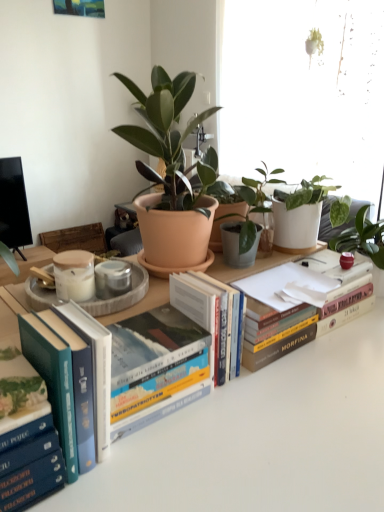
Locate an element on the screen. This screenshot has height=512, width=384. free space above hardcover book at center, positioned as the third book in left-to-right order (from a real-world perspective) is located at coordinates (144, 334).